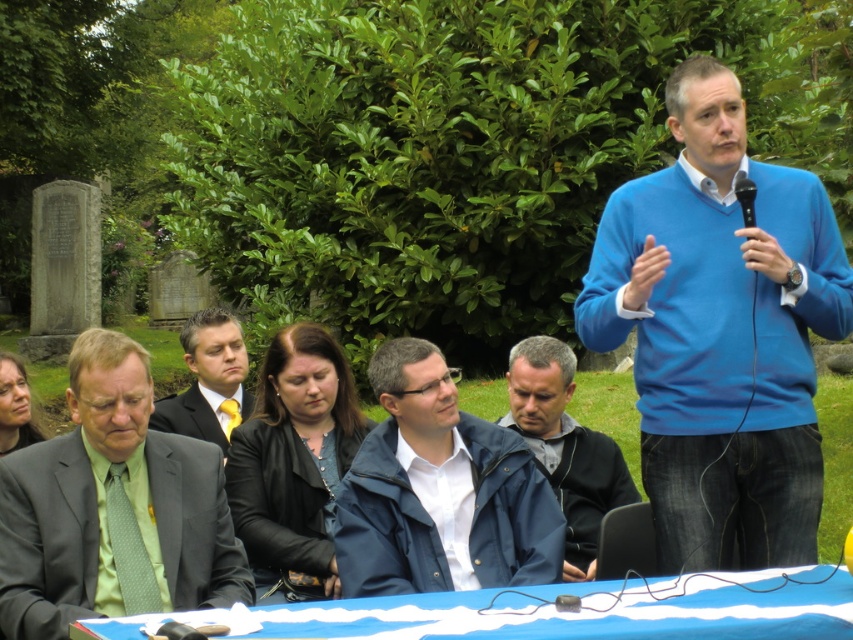
Does green silk tie at left have a greater height compared to black plastic microphone at upper right?

Indeed, green silk tie at left has a greater height compared to black plastic microphone at upper right.

Which is more to the right, green silk tie at left or black plastic microphone at upper right?

black plastic microphone at upper right is more to the right.

Between point (190, 513) and point (749, 188), which one is positioned in front?

Point (190, 513) is in front.

Find the location of `green silk tie at left`. green silk tie at left is located at coordinates (113, 508).

Between blue fabric table at lower center and dark suit at center, which one appears on the left side from the viewer's perspective?

dark suit at center is more to the left.

Image resolution: width=853 pixels, height=640 pixels. In order to click on blue fabric table at lower center in this screenshot , I will do `click(590, 611)`.

The width and height of the screenshot is (853, 640). I want to click on blue fabric table at lower center, so click(590, 611).

Which is more to the right, black leather jacket at center or dark suit at center?

black leather jacket at center

Does black leather jacket at center have a greater width compared to dark suit at center?

Indeed, black leather jacket at center has a greater width compared to dark suit at center.

Where is `black leather jacket at center`? Image resolution: width=853 pixels, height=640 pixels. black leather jacket at center is located at coordinates tap(294, 461).